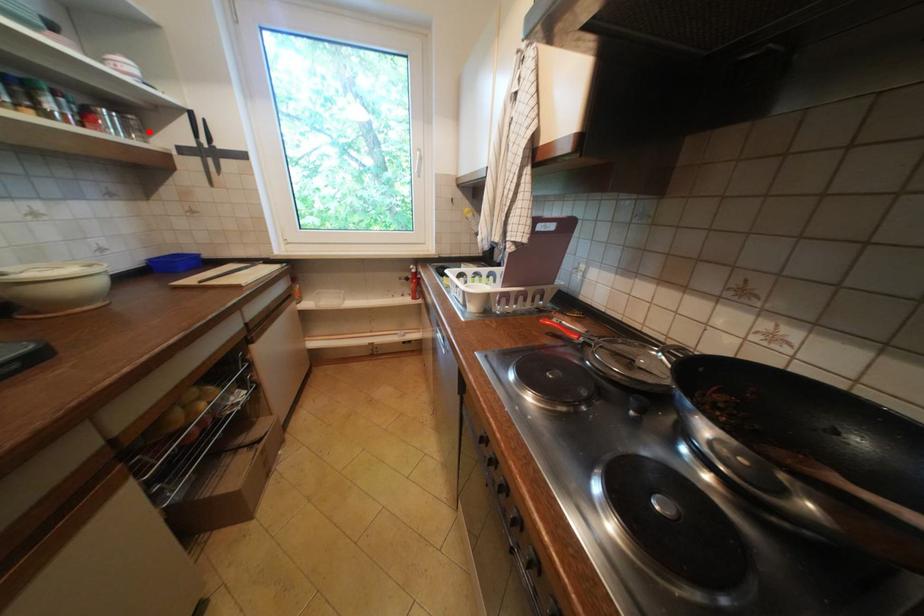
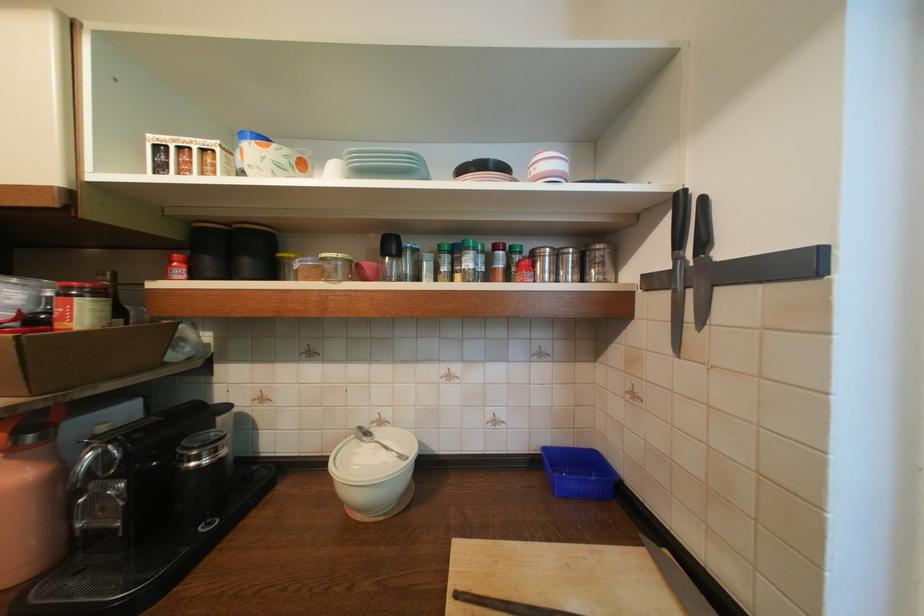
The point at the highlighted location is marked in the first image. Where is the corresponding point in the second image?

(611, 265)